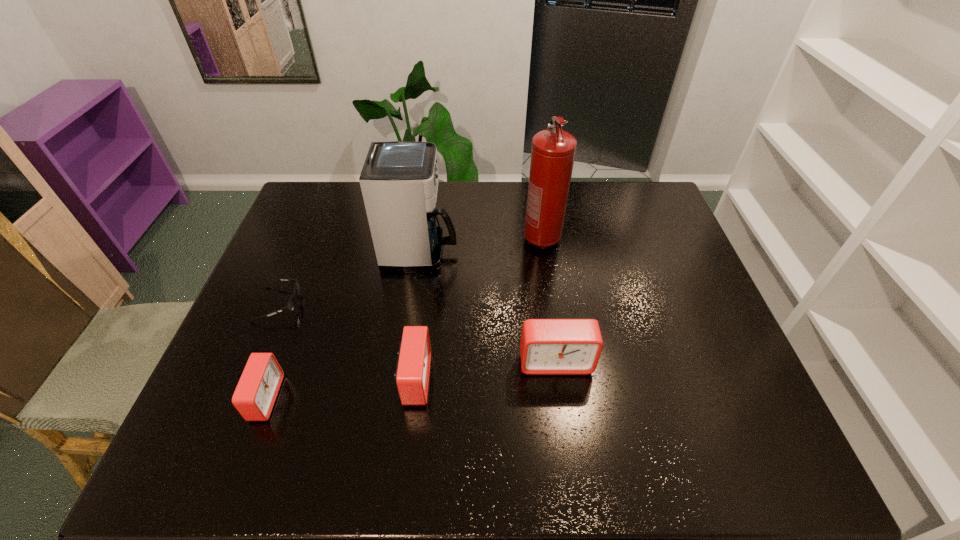
The width and height of the screenshot is (960, 540). Find the location of `vacant space at the near edge`. vacant space at the near edge is located at coordinates (492, 410).

In the image, there is a desktop. Where is `vacant space at the right edge`? Image resolution: width=960 pixels, height=540 pixels. vacant space at the right edge is located at coordinates (670, 255).

In the image, there is a desktop. Identify the location of vacant space at the far left corner. Image resolution: width=960 pixels, height=540 pixels. (342, 185).

Where is `vacant space at the near left corner`? vacant space at the near left corner is located at coordinates pos(215,407).

In the image, there is a desktop. Where is `vacant region at the far right corner`? The image size is (960, 540). vacant region at the far right corner is located at coordinates (645, 190).

The height and width of the screenshot is (540, 960). In order to click on vacant space that is in between the rightmost alarm clock and the coffee maker in this screenshot , I will do `click(488, 307)`.

Where is `vacant space that's between the third shortest object and the rightmost alarm clock`? The width and height of the screenshot is (960, 540). vacant space that's between the third shortest object and the rightmost alarm clock is located at coordinates (485, 370).

Identify the location of empty space that is in between the fifth tallest object and the fire extinguisher. (403, 319).

You are a GUI agent. You are given a task and a screenshot of the screen. Output one action in this format:
    pyautogui.click(x=<x>, y=<y>)
    Task: Click on the blank region between the rightmost alarm clock and the fire extinguisher
    
    Given the screenshot: What is the action you would take?
    pyautogui.click(x=548, y=300)

You are a GUI agent. You are given a task and a screenshot of the screen. Output one action in this format:
    pyautogui.click(x=<x>, y=<y>)
    Task: Click on the vacant point located between the second shortest object and the second alarm clock from right to left
    
    Given the screenshot: What is the action you would take?
    pyautogui.click(x=340, y=389)